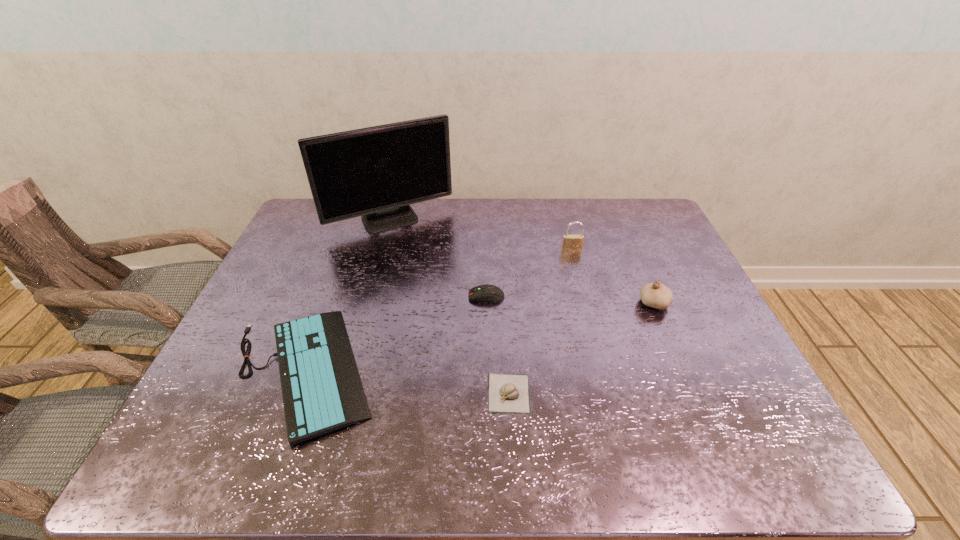
Where is `computer monitor`? The height and width of the screenshot is (540, 960). computer monitor is located at coordinates (376, 172).

You are a GUI agent. You are given a task and a screenshot of the screen. Output one action in this format:
    pyautogui.click(x=<x>, y=<y>)
    Task: Click on the farthest object
    The width and height of the screenshot is (960, 540).
    Given the screenshot: What is the action you would take?
    pyautogui.click(x=376, y=172)

Image resolution: width=960 pixels, height=540 pixels. Find the location of `padlock`. padlock is located at coordinates (571, 243).

This screenshot has height=540, width=960. What are the coordinates of `the second farthest object` in the screenshot? It's located at (571, 243).

Where is `the third tallest object`? the third tallest object is located at coordinates (656, 295).

Where is `the taller garlic`? The width and height of the screenshot is (960, 540). the taller garlic is located at coordinates (656, 295).

Locate an element on the screen. The image size is (960, 540). computer equipment is located at coordinates (487, 293).

Where is `the nearer garlic`? The width and height of the screenshot is (960, 540). the nearer garlic is located at coordinates (507, 393).

Where is `the shorter garlic`? This screenshot has height=540, width=960. the shorter garlic is located at coordinates (507, 393).

Find the location of a particular element. The height and width of the screenshot is (540, 960). computer keyboard is located at coordinates (322, 391).